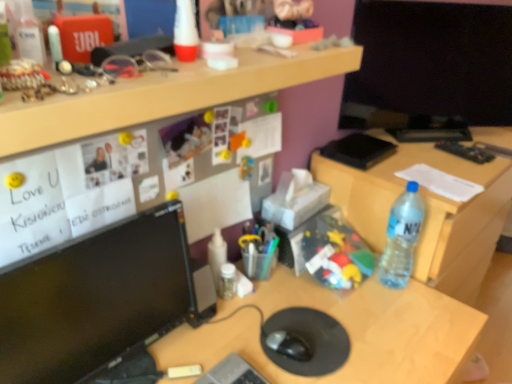
At what (x,y) coordinates should I click in order to perform the action: click on vacant area that lies between translucent plastic bottle at right, marked as the second bottle in a left-to-right arrangement, and black matte mouse at center. Please return your answer as a coordinate pair (x, y). This screenshot has height=384, width=512. Looking at the image, I should click on (340, 312).